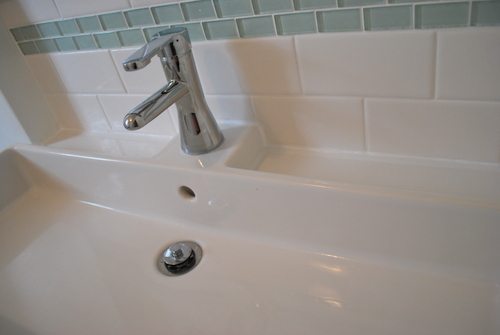
Image resolution: width=500 pixels, height=335 pixels. Identify the location of drain hole. (154, 263), (189, 271), (196, 240).